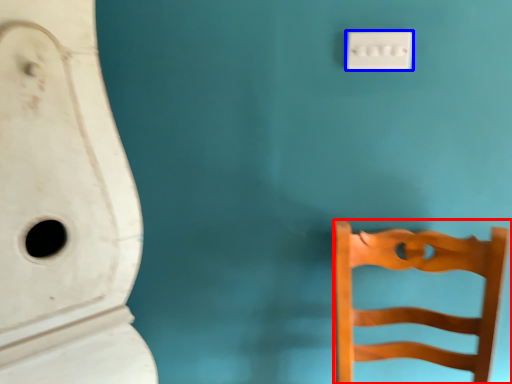
Question: Which object appears farthest to the camera in this image, furniture (highlighted by a red box) or light switch (highlighted by a blue box)?

Choices:
 (A) furniture
 (B) light switch

Answer: (B)